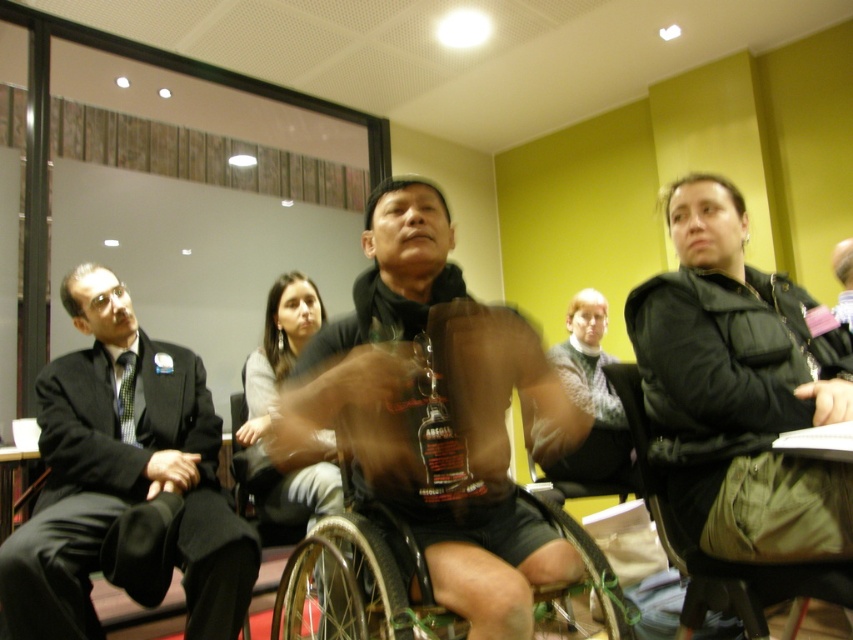
Is point (219, 502) farther from viewer compared to point (805, 588)?

Yes, it is.

Consider the image. Who is more distant from viewer, (x=192, y=582) or (x=762, y=586)?

Positioned behind is point (x=192, y=582).

You are a GUI agent. You are given a task and a screenshot of the screen. Output one action in this format:
    pyautogui.click(x=<x>, y=<y>)
    Task: Click on the black suit at left
    
    Given the screenshot: What is the action you would take?
    pyautogui.click(x=122, y=474)

Locate an element on the screen. The width and height of the screenshot is (853, 640). matte black wheelchair at center is located at coordinates (434, 413).

I want to click on matte black wheelchair at center, so click(434, 413).

In order to click on matte black wheelchair at center in this screenshot , I will do `click(434, 413)`.

Between black plastic wheelchair at center and matte black shirt at center, which one is positioned lower?

black plastic wheelchair at center is lower down.

Which is in front, point (366, 561) or point (526, 426)?

Positioned in front is point (366, 561).

Identify the location of black plastic wheelchair at center. (358, 584).

Where is `black plastic wheelchair at center`? This screenshot has height=640, width=853. black plastic wheelchair at center is located at coordinates (358, 584).